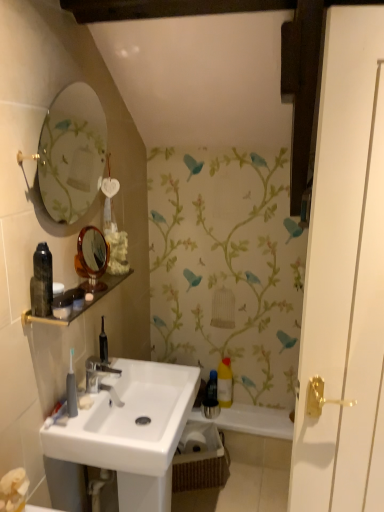
Locate an element on the screen. This screenshot has width=384, height=512. vacant space underneath black glass shelf at upper left (from a real-world perspective) is located at coordinates (94, 391).